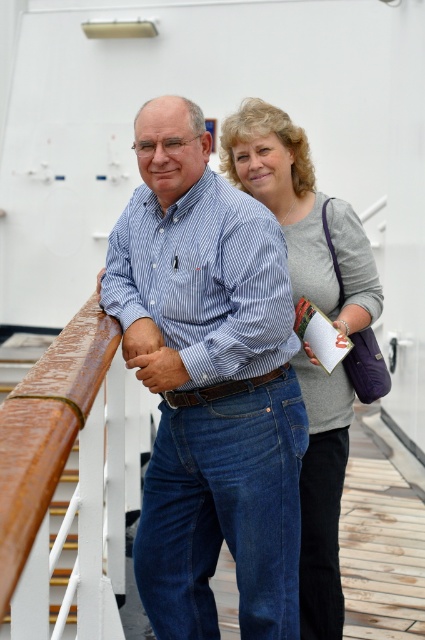
You are a photographer on the deck of a ship. You want to take a photo of the blue striped shirt at center. Where should you aim your camera to capture it?

You should aim your camera at the coordinates point at point (209, 384) to capture the blue striped shirt at center.

You are standing on the deck of a ship and want to reach the point marked at coordinates point (198, 522). If your walking speed is 1.2 meters per second, how many seconds will it take you to reach that point?

The distance between you and the point (198, 522) is 3.13 meters. At a walking speed of 1.2 meters per second, it will take approximately 2.61 seconds to reach the point.